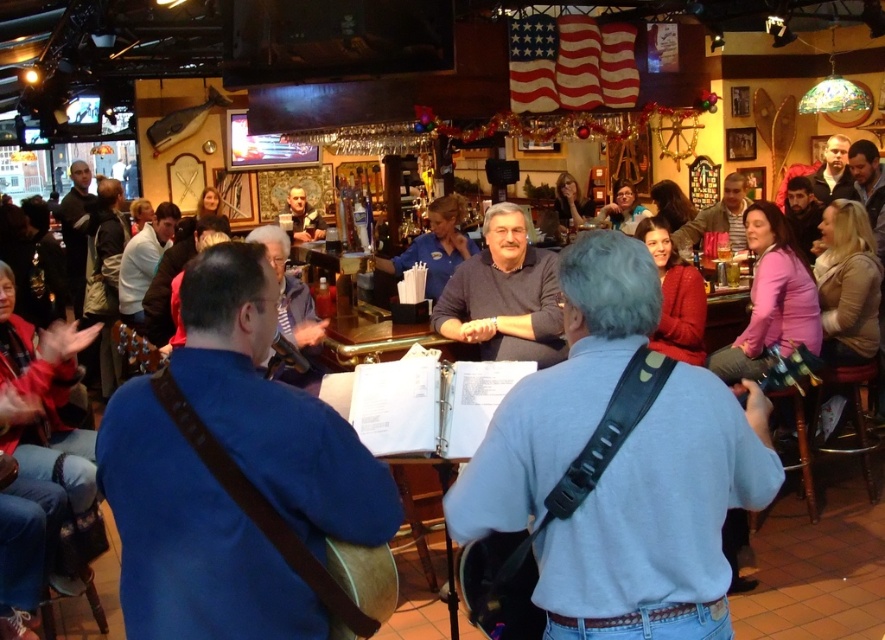
Between metallic gold guitar at center and wooden acoustic guitar at lower left, which one appears on the left side from the viewer's perspective?

wooden acoustic guitar at lower left is more to the left.

Which is more to the right, metallic gold guitar at center or wooden acoustic guitar at lower left?

Positioned to the right is metallic gold guitar at center.

Who is more distant from viewer, (404,339) or (113,342)?

Point (113,342)

Locate an element on the screen. Image resolution: width=885 pixels, height=640 pixels. metallic gold guitar at center is located at coordinates (376, 346).

Is blue shirt at center shorter than matte black sweater at upper center?

Correct, blue shirt at center is not as tall as matte black sweater at upper center.

Is blue shirt at center closer to the viewer compared to matte black sweater at upper center?

Yes, it is.

Does point (409, 256) lie behind point (573, 212)?

No, it is not.

The image size is (885, 640). Find the location of `blue shirt at center`. blue shirt at center is located at coordinates (435, 248).

Can you confirm if wooden acoustic guitar at lower left is positioned above matte black shirt at center?

No, wooden acoustic guitar at lower left is not above matte black shirt at center.

Who is lower down, wooden acoustic guitar at lower left or matte black shirt at center?

Positioned lower is wooden acoustic guitar at lower left.

This screenshot has height=640, width=885. What do you see at coordinates (137, 348) in the screenshot? I see `wooden acoustic guitar at lower left` at bounding box center [137, 348].

Identify the location of wooden acoustic guitar at lower left. (137, 348).